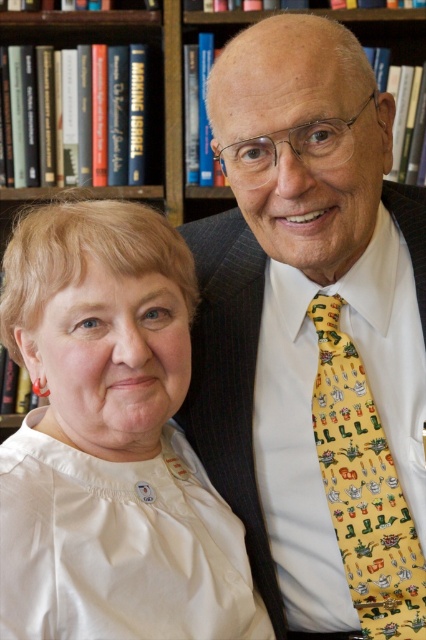
From the picture: You are a photographer setting up a shoot in this scene. You need to ensure that the yellow printed tie at center and the wooden bookshelf at upper center are both visible in the frame. Based on their positions, which object is closer to the right edge of the image?

The yellow printed tie at center is positioned on the right side of the wooden bookshelf at upper center, so it is closer to the right edge of the image.